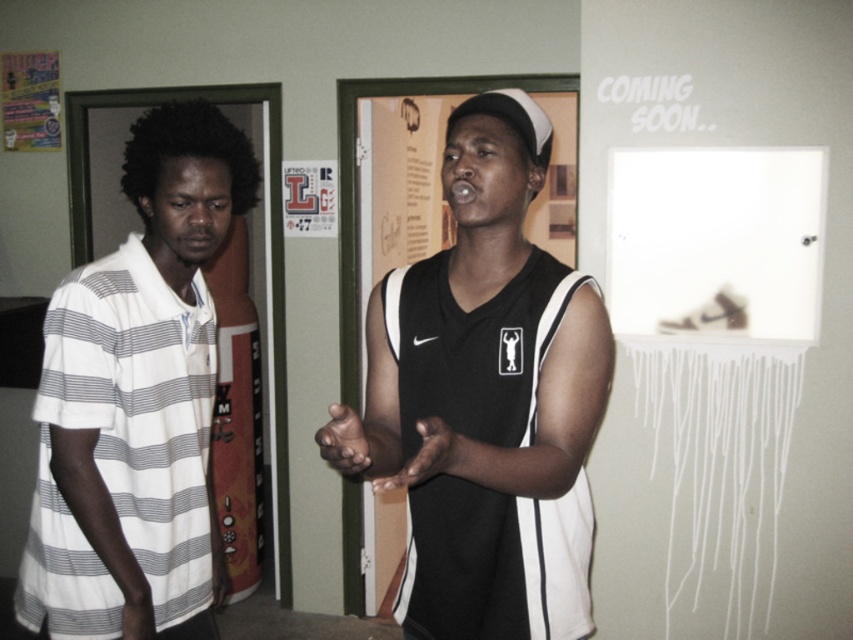
Between point (421, 625) and point (151, 616), which one is positioned behind?

Positioned behind is point (151, 616).

Where is `black matte basketball jersey at center`? This screenshot has width=853, height=640. black matte basketball jersey at center is located at coordinates (492, 396).

Identify the location of black matte basketball jersey at center. (492, 396).

Does smooth skin hand at center have a smaller size compared to dark skin hand at center?

Incorrect, smooth skin hand at center is not smaller in size than dark skin hand at center.

Can you confirm if smooth skin hand at center is bigger than dark skin hand at center?

Correct, smooth skin hand at center is larger in size than dark skin hand at center.

Is point (432, 468) closer to viewer compared to point (340, 451)?

No.

At what (x,y) coordinates should I click in order to perform the action: click on smooth skin hand at center. Please return your answer as a coordinate pair (x, y). This screenshot has width=853, height=640. Looking at the image, I should click on (430, 458).

Does white striped polo shirt at left have a larger size compared to smooth skin hand at lower left?

Yes, white striped polo shirt at left is bigger than smooth skin hand at lower left.

Is point (171, 323) more distant than point (140, 620)?

Yes, point (171, 323) is farther from viewer.

Identify the location of white striped polo shirt at left. This screenshot has height=640, width=853. (137, 397).